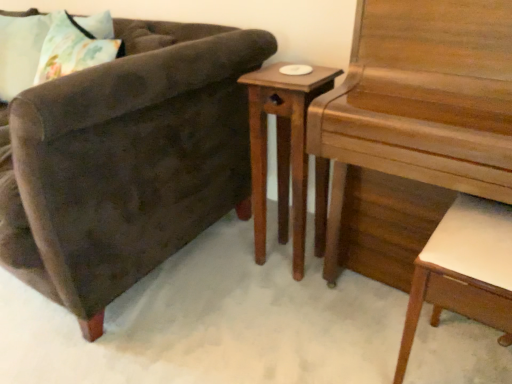
Where is `vacant region to the left of wooden piano at right`? vacant region to the left of wooden piano at right is located at coordinates (256, 312).